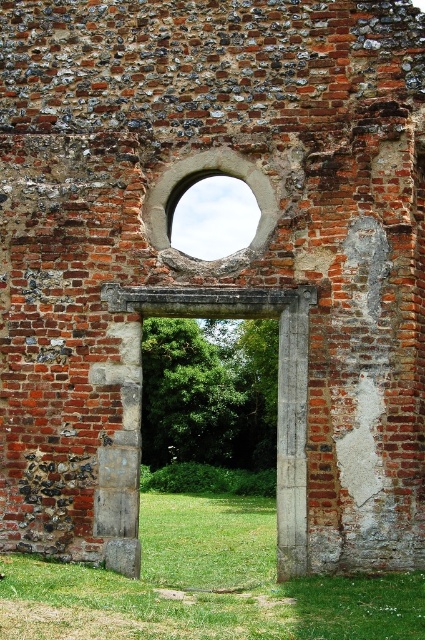
You are standing in front of the old brick structure. You notice a point marked at coordinates [204,586]. What is located at this point?

The point at coordinates [204,586] indicates green grass at lower center.